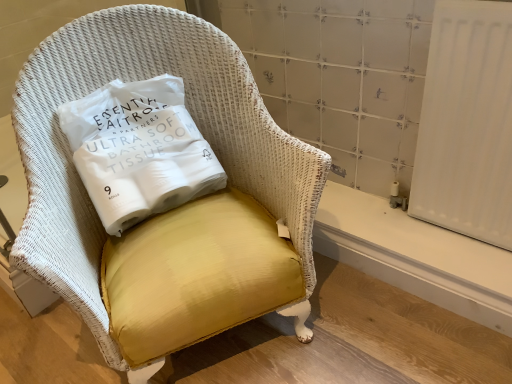
The height and width of the screenshot is (384, 512). What do you see at coordinates (415, 256) in the screenshot? I see `white smooth radiator at lower right` at bounding box center [415, 256].

The image size is (512, 384). What do you see at coordinates (270, 167) in the screenshot?
I see `yellow fabric chair at center` at bounding box center [270, 167].

You are a GUI agent. You are given a task and a screenshot of the screen. Output one action in this format:
    pyautogui.click(x=<x>, y=<y>)
    Task: Click on the white smooth radiator at lower right
    This screenshot has width=512, height=384.
    Given the screenshot: What is the action you would take?
    pyautogui.click(x=415, y=256)

From the image's perspective, is yellow fabric pillow at center positioned above or below white smooth radiator at lower right?

Based on their image positions, yellow fabric pillow at center is located above white smooth radiator at lower right.

Which object is more forward, yellow fabric pillow at center or white smooth radiator at lower right?

yellow fabric pillow at center is closer to the camera.

Between point (123, 102) and point (375, 271), which one is positioned in front?

The point (123, 102) is more forward.

Would you say yellow fabric pillow at center is inside or outside white smooth radiator at lower right?

yellow fabric pillow at center cannot be found inside white smooth radiator at lower right.

Can you confirm if yellow fabric chair at center is taller than white smooth radiator at lower right?

Correct, yellow fabric chair at center is much taller as white smooth radiator at lower right.

Is yellow fabric chair at center next to white smooth radiator at lower right?

yellow fabric chair at center is not next to white smooth radiator at lower right, and they're not touching.

From a real-world perspective, between yellow fabric chair at center and white smooth radiator at lower right, who is vertically lower?

In real-world perspective, white smooth radiator at lower right is lower.

Which object is wider, yellow fabric chair at center or white smooth radiator at lower right?

yellow fabric chair at center is wider.

Locate an element on the screen. pillow above the yellow fabric chair at center (from the image's perspective) is located at coordinates (139, 150).

Is yellow fabric chair at center placed right next to yellow fabric pillow at center?

No, yellow fabric chair at center is not making contact with yellow fabric pillow at center.

How different are the orientations of yellow fabric chair at center and yellow fabric pillow at center in degrees?

The angular difference between yellow fabric chair at center and yellow fabric pillow at center is 11.4 degrees.

From the picture: Is yellow fabric chair at center not inside yellow fabric pillow at center?

yellow fabric chair at center is positioned outside yellow fabric pillow at center.

Is white smooth radiator at lower right closer to camera compared to yellow fabric pillow at center?

That is False.

Is yellow fabric pillow at center a part of white smooth radiator at lower right?

No, yellow fabric pillow at center is not inside white smooth radiator at lower right.

From the picture: Considering the sizes of objects white smooth radiator at lower right and yellow fabric pillow at center in the image provided, who is shorter, white smooth radiator at lower right or yellow fabric pillow at center?

With less height is white smooth radiator at lower right.

Is white smooth radiator at lower right to the left or to the right of yellow fabric pillow at center in the image?

white smooth radiator at lower right is positioned on yellow fabric pillow at center's right side.

Does point (381, 228) come behind point (89, 204)?

Yes, point (381, 228) is farther from viewer.

Consider the image. From the image's perspective, is white smooth radiator at lower right located beneath yellow fabric chair at center?

Indeed, from the image's perspective, white smooth radiator at lower right is shown beneath yellow fabric chair at center.

Does white smooth radiator at lower right have a greater width compared to yellow fabric chair at center?

No, white smooth radiator at lower right is not wider than yellow fabric chair at center.

From a real-world perspective, is white smooth radiator at lower right located higher than yellow fabric chair at center?

No, from a real-world perspective, white smooth radiator at lower right is not over yellow fabric chair at center

From a real-world perspective, between yellow fabric pillow at center and yellow fabric chair at center, who is vertically higher?

yellow fabric pillow at center, from a real-world perspective.

Is yellow fabric pillow at center bigger than yellow fabric chair at center?

No, yellow fabric pillow at center is not bigger than yellow fabric chair at center.

In the scene shown: Do you think yellow fabric pillow at center is within yellow fabric chair at center, or outside of it?

yellow fabric pillow at center is enclosed within yellow fabric chair at center.

Identify the location of chair lying below the yellow fabric pillow at center (from the image's perspective). (270, 167).

What are the coordinates of `pillow that appears above the white smooth radiator at lower right (from the image's perspective)` in the screenshot? It's located at (139, 150).

The image size is (512, 384). I want to click on chair above the white smooth radiator at lower right (from a real-world perspective), so click(x=270, y=167).

Estimate the real-world distances between objects in this image. Which object is further from yellow fabric pillow at center, yellow fabric chair at center or white smooth radiator at lower right?

Based on the image, white smooth radiator at lower right appears to be further to yellow fabric pillow at center.

Based on their spatial positions, is yellow fabric chair at center or yellow fabric pillow at center closer to white smooth radiator at lower right?

yellow fabric chair at center.

Estimate the real-world distances between objects in this image. Which object is further from yellow fabric pillow at center, white smooth radiator at lower right or yellow fabric chair at center?

white smooth radiator at lower right.

Considering their positions, is yellow fabric pillow at center positioned closer to white smooth radiator at lower right than yellow fabric chair at center?

The object closer to white smooth radiator at lower right is yellow fabric chair at center.

From the image, which object appears to be farther from yellow fabric chair at center, yellow fabric pillow at center or white smooth radiator at lower right?

Based on the image, white smooth radiator at lower right appears to be further to yellow fabric chair at center.

When comparing their distances from yellow fabric chair at center, does white smooth radiator at lower right or yellow fabric pillow at center seem closer?

Based on the image, yellow fabric pillow at center appears to be nearer to yellow fabric chair at center.

You are a GUI agent. You are given a task and a screenshot of the screen. Output one action in this format:
    pyautogui.click(x=<x>, y=<y>)
    Task: Click on the chair between yellow fabric pillow at center and white smooth radiator at lower right
    
    Given the screenshot: What is the action you would take?
    pyautogui.click(x=270, y=167)